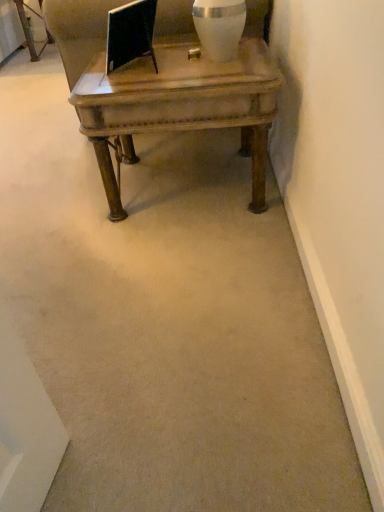
I want to click on vacant space to the left of white glossy vase at upper center, so click(175, 69).